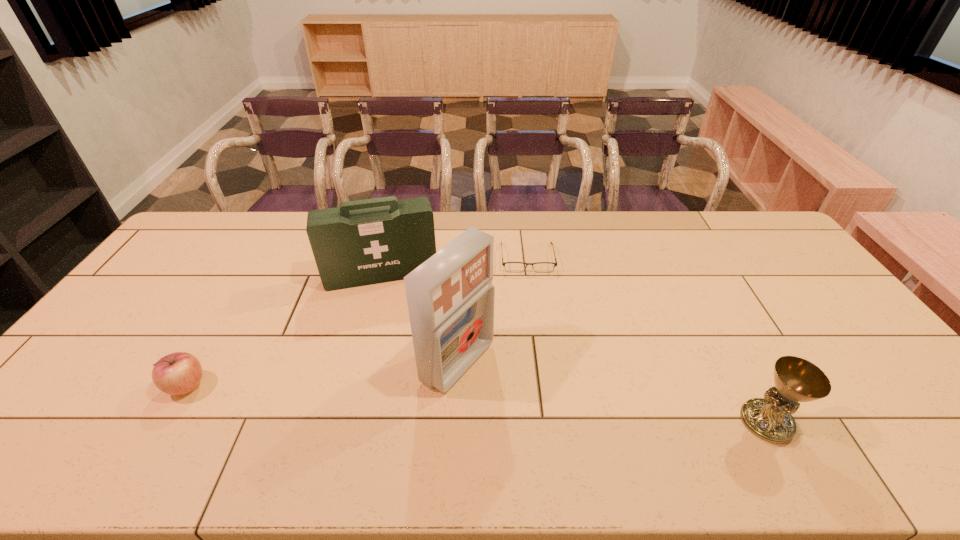
Identify the location of chalice at the near edge. The image size is (960, 540). (796, 380).

Identify the location of the first-aid kit positioned at the near edge. (450, 296).

This screenshot has height=540, width=960. In the image, there is a desktop. In order to click on vacant area at the far edge in this screenshot , I will do `click(294, 237)`.

You are a GUI agent. You are given a task and a screenshot of the screen. Output one action in this format:
    pyautogui.click(x=<x>, y=<y>)
    Task: Click on the free point at the near edge
    The height and width of the screenshot is (540, 960).
    Given the screenshot: What is the action you would take?
    pyautogui.click(x=848, y=400)

Find the location of a particular element. This screenshot has width=960, height=540. free space at the left edge of the desktop is located at coordinates (149, 326).

In the image, there is a desktop. Find the location of `vacant space at the right edge`. vacant space at the right edge is located at coordinates (745, 252).

Where is `blank space at the far left corner`? The width and height of the screenshot is (960, 540). blank space at the far left corner is located at coordinates (231, 220).

Identify the location of blank space at the far right corner of the desktop. The image size is (960, 540). (732, 211).

Find the location of `free point between the taller first-aid kit and the apple`. free point between the taller first-aid kit and the apple is located at coordinates (323, 374).

You are a GUI agent. You are given a task and a screenshot of the screen. Output one action in this format:
    pyautogui.click(x=<x>, y=<y>)
    Task: Click on the free point between the second object from right to left and the third tallest object
    The width and height of the screenshot is (960, 540).
    Given the screenshot: What is the action you would take?
    pyautogui.click(x=647, y=340)